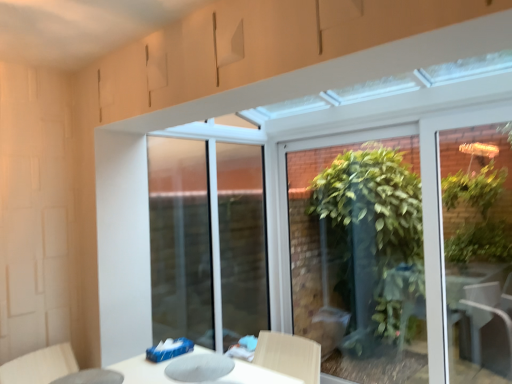
Question: Is light beige fabric swivel chair at lower left located outside transparent glass table at lower left?

Choices:
 (A) no
 (B) yes

Answer: (B)

Question: Would you consider light beige fabric swivel chair at lower left to be distant from transparent glass table at lower left?

Choices:
 (A) no
 (B) yes

Answer: (A)

Question: From a real-world perspective, is light beige fabric swivel chair at lower left on transparent glass table at lower left?

Choices:
 (A) yes
 (B) no

Answer: (B)

Question: Can transparent glass table at lower left be found inside light beige fabric swivel chair at lower left?

Choices:
 (A) no
 (B) yes

Answer: (B)

Question: Is light beige fabric swivel chair at lower left positioned in front of transparent glass table at lower left?

Choices:
 (A) no
 (B) yes

Answer: (A)

Question: Is light beige fabric swivel chair at lower left behind transparent glass table at lower left?

Choices:
 (A) no
 (B) yes

Answer: (B)

Question: Is transparent glass table at lower left at the right side of green leafy plant at center?

Choices:
 (A) no
 (B) yes

Answer: (A)

Question: Considering the relative sizes of transparent glass table at lower left and green leafy plant at center in the image provided, is transparent glass table at lower left smaller than green leafy plant at center?

Choices:
 (A) no
 (B) yes

Answer: (B)

Question: Considering the relative sizes of transparent glass table at lower left and green leafy plant at center in the image provided, is transparent glass table at lower left thinner than green leafy plant at center?

Choices:
 (A) yes
 (B) no

Answer: (B)

Question: Could you tell me if transparent glass table at lower left is facing green leafy plant at center?

Choices:
 (A) yes
 (B) no

Answer: (B)

Question: Is transparent glass table at lower left positioned far away from green leafy plant at center?

Choices:
 (A) yes
 (B) no

Answer: (A)

Question: Is transparent glass table at lower left surrounding green leafy plant at center?

Choices:
 (A) no
 (B) yes

Answer: (A)

Question: From a real-world perspective, is transparent glass table at lower left positioned under light beige fabric swivel chair at lower left based on gravity?

Choices:
 (A) no
 (B) yes

Answer: (A)